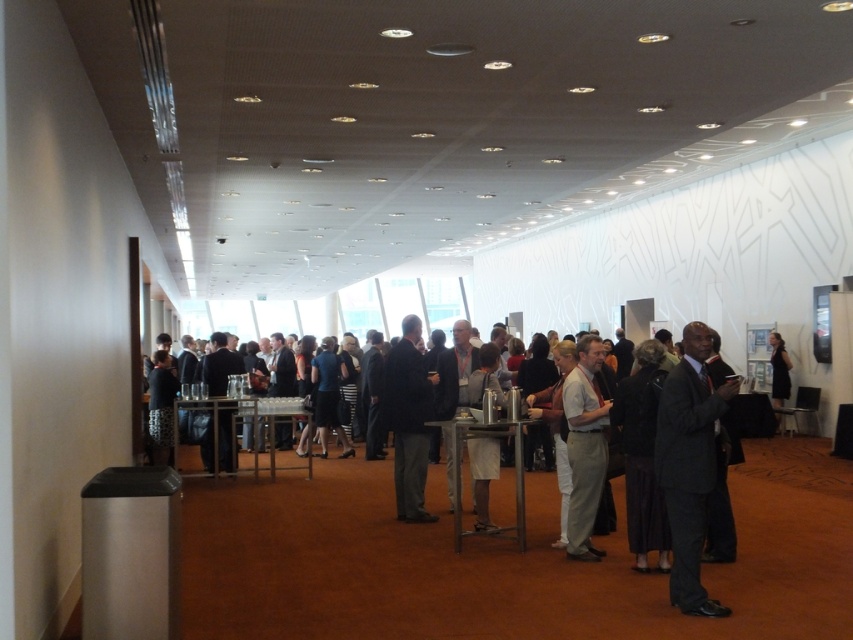
How far apart are dark suit at center and dark gray suit at center?

dark suit at center and dark gray suit at center are 4.61 feet apart.

Is point (548, 573) closer to camera compared to point (393, 440)?

Yes, point (548, 573) is closer to viewer.

This screenshot has height=640, width=853. I want to click on dark suit at center, so click(x=393, y=563).

Can you confirm if dark gray suit at right is bigger than light beige fabric shirt at center?

Yes, dark gray suit at right is bigger than light beige fabric shirt at center.

What do you see at coordinates (689, 465) in the screenshot? Image resolution: width=853 pixels, height=640 pixels. I see `dark gray suit at right` at bounding box center [689, 465].

The width and height of the screenshot is (853, 640). What do you see at coordinates (689, 465) in the screenshot? I see `dark gray suit at right` at bounding box center [689, 465].

The height and width of the screenshot is (640, 853). What are the coordinates of `dark gray suit at right` in the screenshot? It's located at (689, 465).

Can you confirm if light beige fabric shirt at center is bigger than dark brown leather jacket at right?

→ Correct, light beige fabric shirt at center is larger in size than dark brown leather jacket at right.

What do you see at coordinates (584, 448) in the screenshot? Image resolution: width=853 pixels, height=640 pixels. I see `light beige fabric shirt at center` at bounding box center [584, 448].

Find the location of a particular element. The height and width of the screenshot is (640, 853). light beige fabric shirt at center is located at coordinates (584, 448).